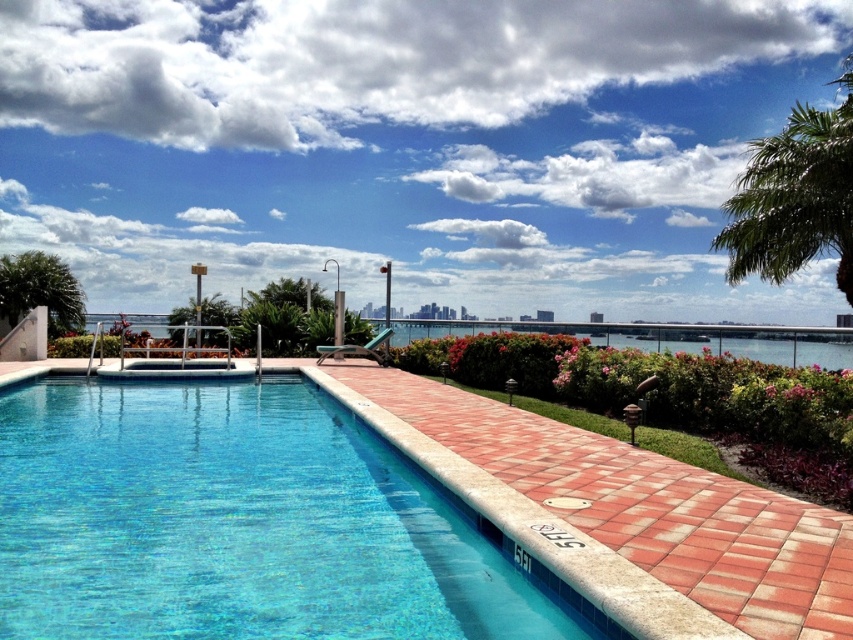
Does green leafy palm tree at upper right have a greater height compared to green leafy palm tree at upper left?

Yes.

You are a GUI agent. You are given a task and a screenshot of the screen. Output one action in this format:
    pyautogui.click(x=<x>, y=<y>)
    Task: Click on the green leafy palm tree at upper right
    This screenshot has width=853, height=640.
    Given the screenshot: What is the action you would take?
    pyautogui.click(x=793, y=196)

Who is more distant from viewer, (769, 196) or (48, 264)?

The point (48, 264) is more distant.

Locate an element on the screen. This screenshot has width=853, height=640. green leafy palm tree at upper right is located at coordinates (793, 196).

Between blue tile swimming pool at center and green leafy palm tree at upper left, which one has more height?

blue tile swimming pool at center is taller.

Between point (33, 426) and point (39, 275), which one is positioned in front?

Point (33, 426)

At what (x,y) coordinates should I click in order to perform the action: click on blue tile swimming pool at center. Please return your answer as a coordinate pair (x, y). Looking at the image, I should click on click(234, 522).

Between blue tile swimming pool at center and green leafy palm tree at upper right, which one has more height?

green leafy palm tree at upper right is taller.

Where is `blue tile swimming pool at center`? blue tile swimming pool at center is located at coordinates (234, 522).

Locate an element on the screen. The image size is (853, 640). blue tile swimming pool at center is located at coordinates (234, 522).